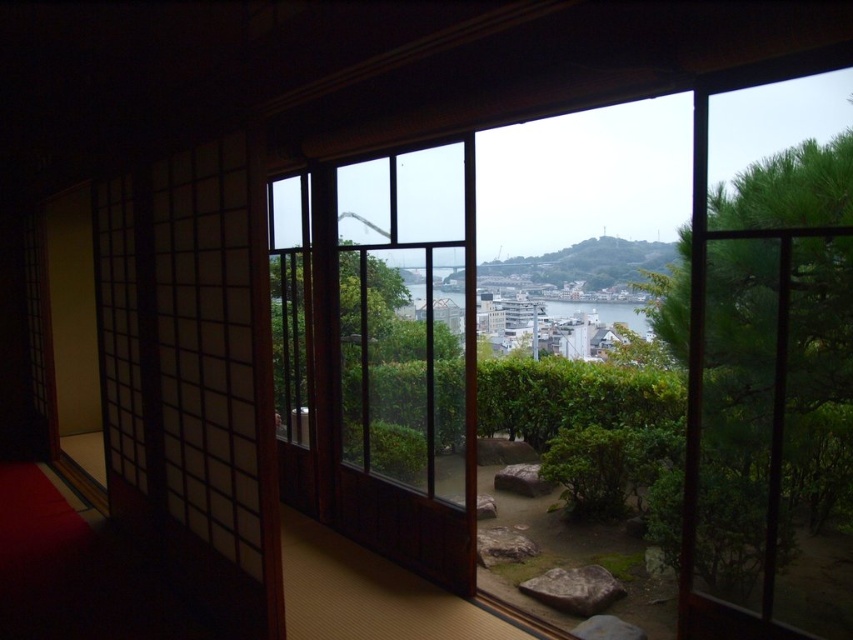
Imagine you are standing in the traditional Japanese room looking through the partially open shoji screens. You notice two points marked in the scene. Which of the two points, point [466,221] or point [581,577], is closer to your viewpoint?

Point [466,221] is closer to the camera than point [581,577], so it is the closer one to your viewpoint.

You are standing in the traditional Japanese room and want to look outside through the transparent glass window at center. Where should you look to see the window?

You should look at point (598, 346) to see the transparent glass window at center.